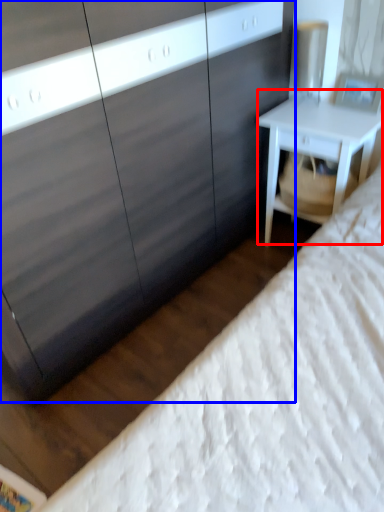
Question: Which of the following is the closest to the observer, nightstand (highlighted by a red box) or dresser (highlighted by a blue box)?

Choices:
 (A) nightstand
 (B) dresser

Answer: (B)